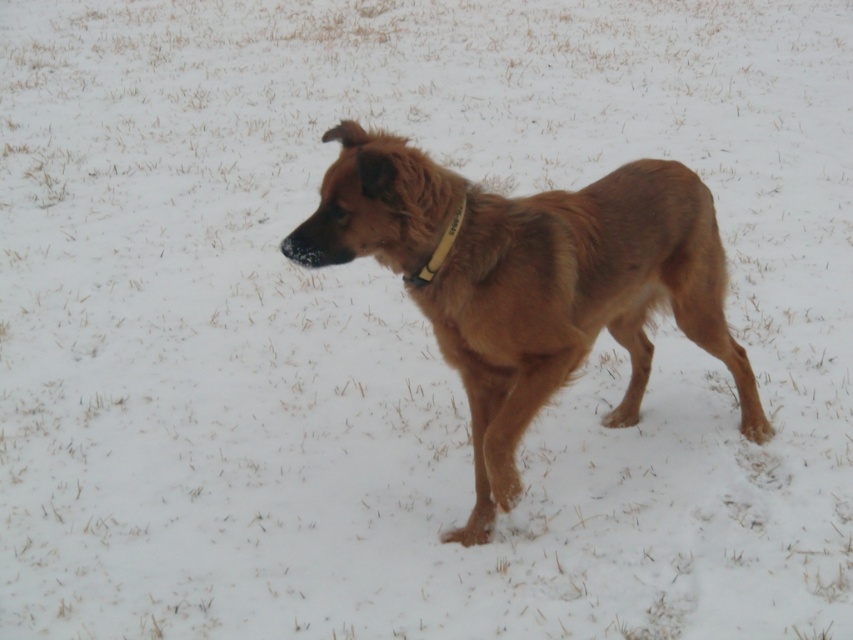
Does brown furry dog at center appear on the right side of yellow fabric neckband at center?

Indeed, brown furry dog at center is positioned on the right side of yellow fabric neckband at center.

Which is more to the left, brown furry dog at center or yellow fabric neckband at center?

yellow fabric neckband at center

Does point (537, 275) come farther from viewer compared to point (444, 244)?

Yes, point (537, 275) is behind point (444, 244).

The height and width of the screenshot is (640, 853). Identify the location of brown furry dog at center. (531, 282).